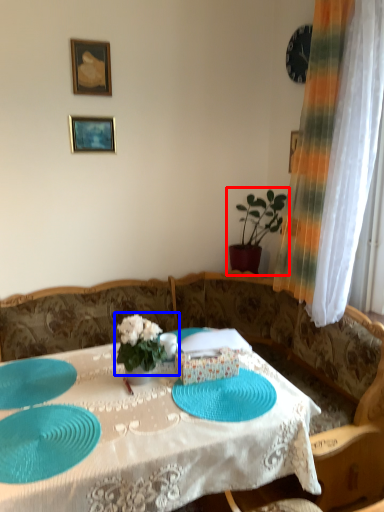
Question: Which object appears farthest to the camera in this image, houseplant (highlighted by a red box) or floral arrangement (highlighted by a blue box)?

Choices:
 (A) houseplant
 (B) floral arrangement

Answer: (A)